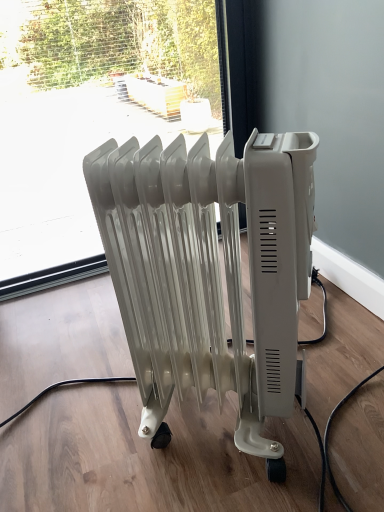
Question: Can transparent glass window at center be found inside white plastic radiator at center?

Choices:
 (A) yes
 (B) no

Answer: (B)

Question: Can you confirm if white plastic radiator at center is positioned to the right of transparent glass window at center?

Choices:
 (A) yes
 (B) no

Answer: (A)

Question: Does white plastic radiator at center turn towards transparent glass window at center?

Choices:
 (A) yes
 (B) no

Answer: (B)

Question: Considering the relative sizes of white plastic radiator at center and transparent glass window at center in the image provided, is white plastic radiator at center shorter than transparent glass window at center?

Choices:
 (A) no
 (B) yes

Answer: (B)

Question: Is white plastic radiator at center further to the viewer compared to transparent glass window at center?

Choices:
 (A) yes
 (B) no

Answer: (B)

Question: From the image's perspective, is white plastic radiator at center under transparent glass window at center?

Choices:
 (A) no
 (B) yes

Answer: (B)

Question: Is transparent glass window at center taller than white plastic radiator at center?

Choices:
 (A) yes
 (B) no

Answer: (A)

Question: Is white plastic radiator at center a part of transparent glass window at center?

Choices:
 (A) no
 (B) yes

Answer: (A)

Question: Considering the relative sizes of transparent glass window at center and white plastic radiator at center in the image provided, is transparent glass window at center smaller than white plastic radiator at center?

Choices:
 (A) yes
 (B) no

Answer: (B)

Question: Does transparent glass window at center have a lesser height compared to white plastic radiator at center?

Choices:
 (A) no
 (B) yes

Answer: (A)

Question: Is transparent glass window at center positioned beyond the bounds of white plastic radiator at center?

Choices:
 (A) no
 (B) yes

Answer: (B)

Question: Does transparent glass window at center turn towards white plastic radiator at center?

Choices:
 (A) yes
 (B) no

Answer: (A)

Question: Is transparent glass window at center wider or thinner than white plastic radiator at center?

Choices:
 (A) wide
 (B) thin

Answer: (B)